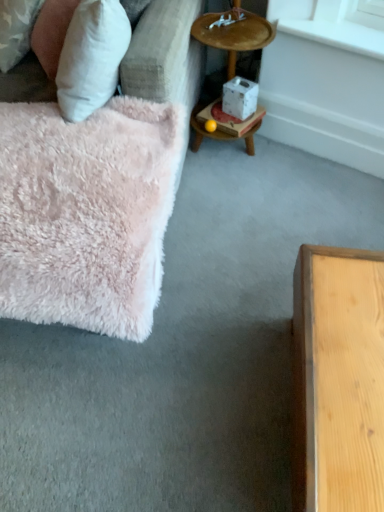
Question: Is white smooth window sill at upper right in front of fluffy pink rug at left?

Choices:
 (A) no
 (B) yes

Answer: (A)

Question: Does white smooth window sill at upper right appear on the right side of fluffy pink rug at left?

Choices:
 (A) yes
 (B) no

Answer: (A)

Question: Is white smooth window sill at upper right turned away from fluffy pink rug at left?

Choices:
 (A) no
 (B) yes

Answer: (A)

Question: Would you consider white smooth window sill at upper right to be distant from fluffy pink rug at left?

Choices:
 (A) no
 (B) yes

Answer: (A)

Question: From a real-world perspective, does white smooth window sill at upper right sit lower than fluffy pink rug at left?

Choices:
 (A) yes
 (B) no

Answer: (B)

Question: Considering the positions of white cardboard box at center and fluffy pink rug at left in the image, is white cardboard box at center wider or thinner than fluffy pink rug at left?

Choices:
 (A) wide
 (B) thin

Answer: (B)

Question: Is white cardboard box at center in front of or behind fluffy pink rug at left in the image?

Choices:
 (A) front
 (B) behind

Answer: (B)

Question: From the image's perspective, is white cardboard box at center located above or below fluffy pink rug at left?

Choices:
 (A) below
 (B) above

Answer: (B)

Question: Looking at the image, does white cardboard box at center seem bigger or smaller compared to fluffy pink rug at left?

Choices:
 (A) big
 (B) small

Answer: (B)

Question: Considering the positions of point (69, 22) and point (299, 16), is point (69, 22) closer or farther from the camera than point (299, 16)?

Choices:
 (A) farther
 (B) closer

Answer: (B)

Question: Is white fluffy pillow at upper left in front of or behind white smooth window sill at upper right in the image?

Choices:
 (A) behind
 (B) front

Answer: (B)

Question: Is white fluffy pillow at upper left inside the boundaries of white smooth window sill at upper right, or outside?

Choices:
 (A) inside
 (B) outside

Answer: (B)

Question: In terms of size, does white fluffy pillow at upper left appear bigger or smaller than white smooth window sill at upper right?

Choices:
 (A) big
 (B) small

Answer: (A)

Question: Based on their sizes in the image, would you say white smooth window sill at upper right is bigger or smaller than wooden tray at upper right?

Choices:
 (A) big
 (B) small

Answer: (B)

Question: Would you say white smooth window sill at upper right is to the left or to the right of wooden tray at upper right in the picture?

Choices:
 (A) left
 (B) right

Answer: (B)